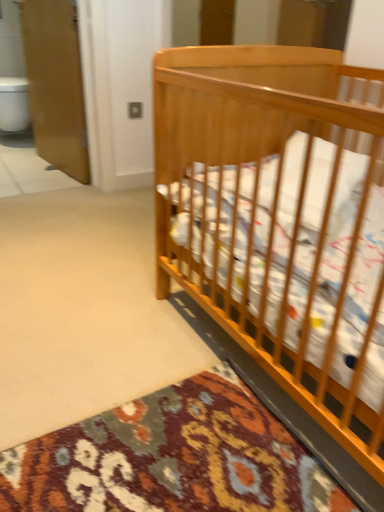
This screenshot has height=512, width=384. Identify the location of vacant space in front of wooden screen door at upper left. (36, 185).